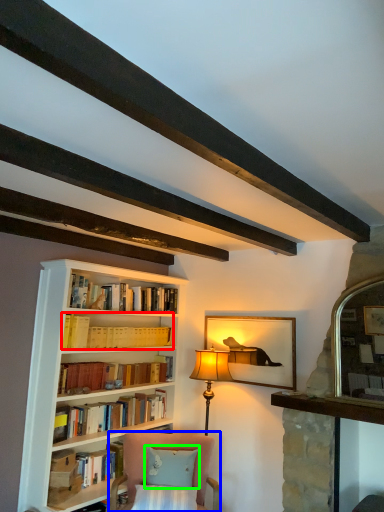
Question: Estimate the real-world distances between objects in this image. Which object is farther from book (highlighted by a red box), chair (highlighted by a blue box) or pillow (highlighted by a green box)?

Choices:
 (A) chair
 (B) pillow

Answer: (B)